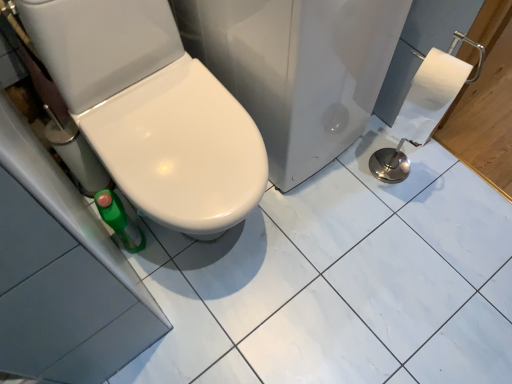
Question: Considering the relative sizes of white glossy toilet seat at center and white glossy toilet at lower left in the image provided, is white glossy toilet seat at center taller than white glossy toilet at lower left?

Choices:
 (A) no
 (B) yes

Answer: (B)

Question: Considering the relative positions of white glossy toilet seat at center and white glossy toilet at lower left in the image provided, is white glossy toilet seat at center to the left of white glossy toilet at lower left from the viewer's perspective?

Choices:
 (A) yes
 (B) no

Answer: (B)

Question: From the image's perspective, is white glossy toilet seat at center over white glossy toilet at lower left?

Choices:
 (A) yes
 (B) no

Answer: (A)

Question: Would you say white glossy toilet seat at center contains white glossy toilet at lower left?

Choices:
 (A) no
 (B) yes

Answer: (A)

Question: Can you confirm if white glossy toilet seat at center is thinner than white glossy toilet at lower left?

Choices:
 (A) no
 (B) yes

Answer: (A)

Question: Are white glossy toilet seat at center and white glossy toilet at lower left located far from each other?

Choices:
 (A) no
 (B) yes

Answer: (A)

Question: Is the depth of white glossy toilet at lower left less than that of white glossy toilet seat at center?

Choices:
 (A) no
 (B) yes

Answer: (B)

Question: Is white glossy toilet at lower left far away from white glossy toilet seat at center?

Choices:
 (A) no
 (B) yes

Answer: (A)

Question: Can we say white glossy toilet at lower left lies outside white glossy toilet seat at center?

Choices:
 (A) no
 (B) yes

Answer: (B)

Question: Is the position of white glossy toilet at lower left more distant than that of white glossy toilet seat at center?

Choices:
 (A) no
 (B) yes

Answer: (A)

Question: Can you confirm if white glossy toilet at lower left is thinner than white glossy toilet seat at center?

Choices:
 (A) yes
 (B) no

Answer: (A)

Question: Is white glossy toilet at lower left wider than white glossy toilet seat at center?

Choices:
 (A) yes
 (B) no

Answer: (B)

Question: Is white glossy toilet at lower left inside the boundaries of white glossy toilet seat at center, or outside?

Choices:
 (A) inside
 (B) outside

Answer: (B)